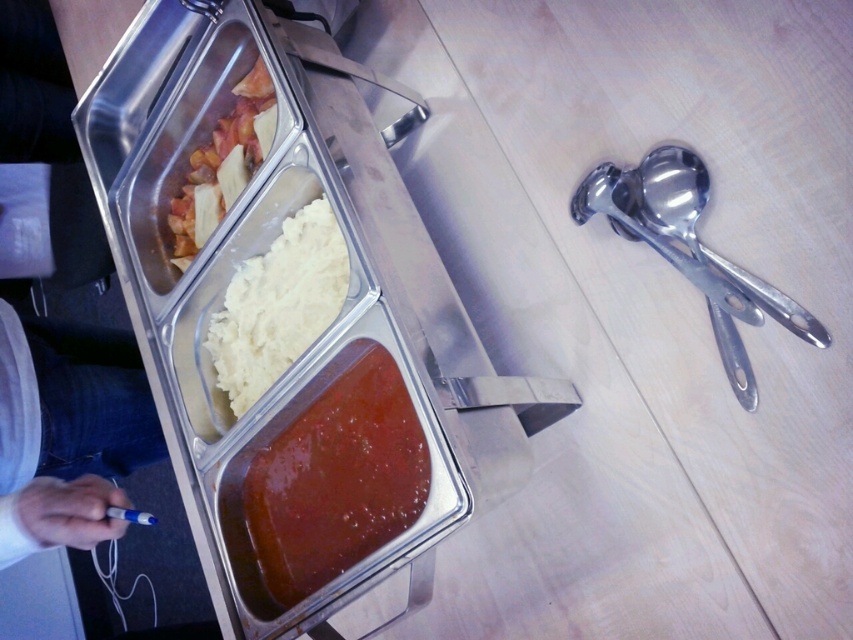
Who is more forward, (248, 176) or (741, 298)?

Point (741, 298) is in front.

Who is taller, matte plastic pasta at upper left or satin silver spoon at right?

Standing taller between the two is matte plastic pasta at upper left.

Does point (233, 129) lie behind point (685, 276)?

Yes, point (233, 129) is behind point (685, 276).

Find the location of a particular element. The width and height of the screenshot is (853, 640). matte plastic pasta at upper left is located at coordinates (223, 164).

How distant is shiny red sauce at center from shiny metallic spoon at right?

shiny red sauce at center and shiny metallic spoon at right are 15.84 inches apart from each other.

Between point (292, 524) and point (686, 204), which one is positioned behind?

The point (292, 524) is behind.

This screenshot has height=640, width=853. Describe the element at coordinates (335, 480) in the screenshot. I see `shiny red sauce at center` at that location.

I want to click on shiny red sauce at center, so click(x=335, y=480).

Between shiny red sauce at center and matte plastic pasta at upper left, which one appears on the right side from the viewer's perspective?

shiny red sauce at center is more to the right.

Which of these two, shiny red sauce at center or matte plastic pasta at upper left, stands shorter?

shiny red sauce at center

Identify the location of shiny red sauce at center. This screenshot has height=640, width=853. (335, 480).

The height and width of the screenshot is (640, 853). I want to click on shiny red sauce at center, so click(335, 480).